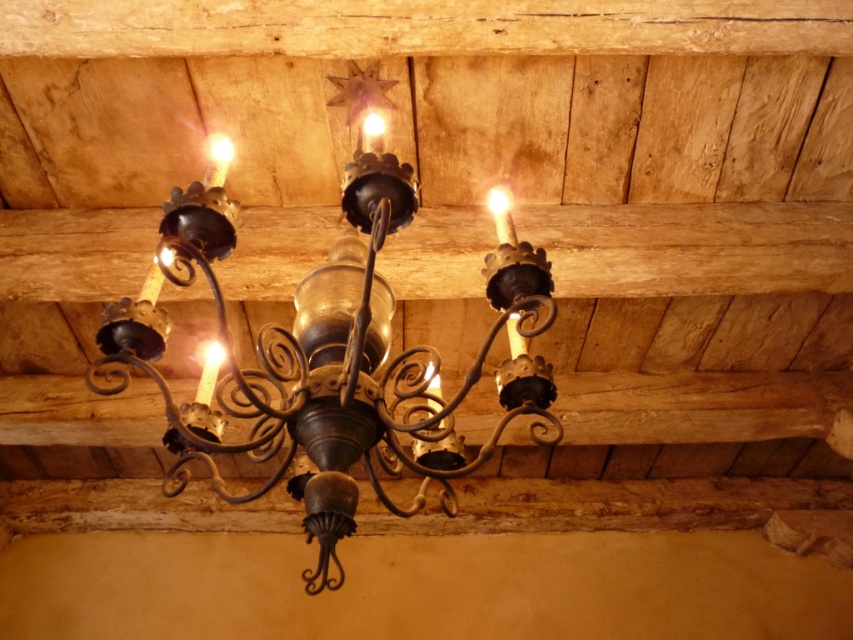
You are an interior designer planning to install a new light fixture in a room with a rustic wooden ceiling. You have two options from the image provided. The first is the antique brass chandelier at center, and the second is the matte glass light at center. If you want to place them side by side on the same ceiling beam, how far apart should they be positioned to maintain the original spacing from the image?

The antique brass chandelier at center and the matte glass light at center are 44.72 centimeters apart in the original image, so they should be placed 44.72 centimeters apart to maintain the original spacing.

You are standing in a room with a vintage chandelier hanging from a rustic wooden ceiling. You notice two points marked in the image. The first point is at coordinates point [306,484] and the second is at point [364,128]. Which point is nearer to you?

Point [306,484] is closer to the viewer than point [364,128].